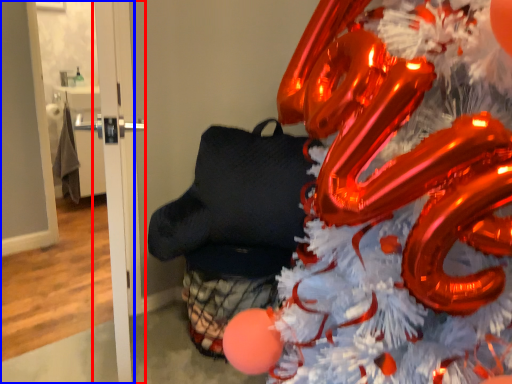
Question: Which of the following is the closest to the observer, door (highlighted by a red box) or door (highlighted by a blue box)?

Choices:
 (A) door
 (B) door

Answer: (A)